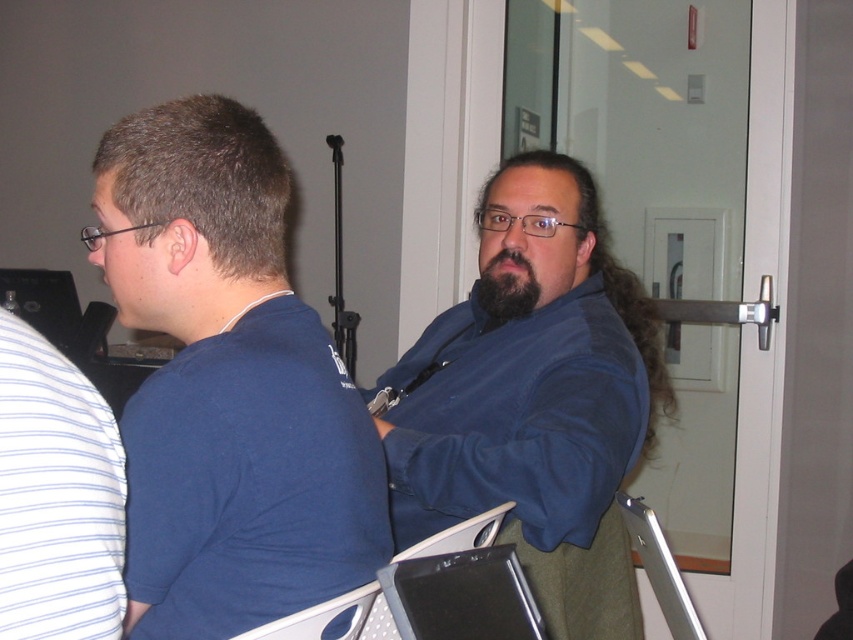
Can you confirm if blue cotton shirt at left is positioned to the left of blue cotton shirt at center?

Correct, you'll find blue cotton shirt at left to the left of blue cotton shirt at center.

This screenshot has height=640, width=853. Find the location of `blue cotton shirt at left`. blue cotton shirt at left is located at coordinates (227, 385).

Between point (355, 509) and point (556, 461), which one is positioned behind?

The point (556, 461) is more distant.

Find the location of a particular element. The width and height of the screenshot is (853, 640). blue cotton shirt at left is located at coordinates (227, 385).

Does transparent glass door at center have a lesser width compared to black fuzzy beard at center?

Incorrect, transparent glass door at center's width is not less than black fuzzy beard at center's.

Is point (778, 115) positioned before point (480, 304)?

No.

Image resolution: width=853 pixels, height=640 pixels. Identify the location of transparent glass door at center. (746, 497).

Find the location of a particular element. The height and width of the screenshot is (640, 853). transparent glass door at center is located at coordinates (746, 497).

Who is higher up, blue cotton shirt at center or transparent glass door at center?

transparent glass door at center is higher up.

Who is shorter, blue cotton shirt at center or transparent glass door at center?

With less height is blue cotton shirt at center.

Locate an element on the screen. The height and width of the screenshot is (640, 853). blue cotton shirt at center is located at coordinates (534, 403).